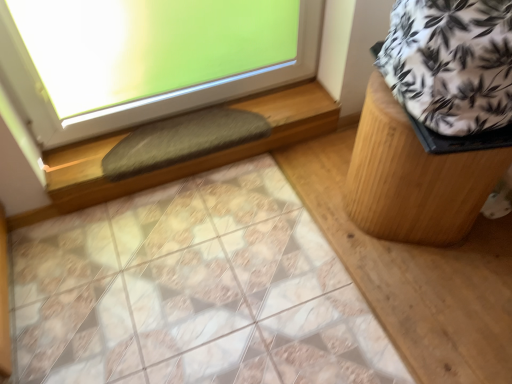
Question: From the image's perspective, is white printed fabric at upper right on top of green felt at upper left?

Choices:
 (A) yes
 (B) no

Answer: (A)

Question: Is white printed fabric at upper right further to camera compared to green felt at upper left?

Choices:
 (A) yes
 (B) no

Answer: (B)

Question: Is green felt at upper left a part of white printed fabric at upper right?

Choices:
 (A) yes
 (B) no

Answer: (B)

Question: From a real-world perspective, is white printed fabric at upper right located higher than green felt at upper left?

Choices:
 (A) no
 (B) yes

Answer: (B)

Question: Is green felt at upper left at the back of white printed fabric at upper right?

Choices:
 (A) yes
 (B) no

Answer: (B)

Question: From a real-world perspective, is wooden stool at right physically located above or below green felt at upper left?

Choices:
 (A) above
 (B) below

Answer: (A)

Question: Is wooden stool at right spatially inside green felt at upper left, or outside of it?

Choices:
 (A) inside
 (B) outside

Answer: (B)

Question: Would you say wooden stool at right is to the left or to the right of green felt at upper left in the picture?

Choices:
 (A) left
 (B) right

Answer: (B)

Question: In the image, is wooden stool at right positioned in front of or behind green felt at upper left?

Choices:
 (A) front
 (B) behind

Answer: (A)

Question: Looking at their shapes, would you say gray fuzzy mat at lower center is wider or thinner than wooden stool at right?

Choices:
 (A) wide
 (B) thin

Answer: (B)

Question: From a real-world perspective, is gray fuzzy mat at lower center positioned above or below wooden stool at right?

Choices:
 (A) above
 (B) below

Answer: (B)

Question: Is gray fuzzy mat at lower center inside or outside of wooden stool at right?

Choices:
 (A) outside
 (B) inside

Answer: (A)

Question: Looking at the image, does gray fuzzy mat at lower center seem bigger or smaller compared to wooden stool at right?

Choices:
 (A) small
 (B) big

Answer: (A)

Question: Is green felt at upper left in front of or behind gray fuzzy mat at lower center in the image?

Choices:
 (A) front
 (B) behind

Answer: (A)

Question: From a real-world perspective, is green felt at upper left positioned above or below gray fuzzy mat at lower center?

Choices:
 (A) below
 (B) above

Answer: (A)